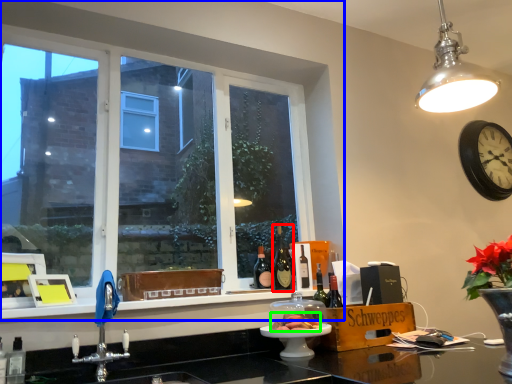
Question: Estimate the real-world distances between objects in this image. Which object is closer to bottle (highlighted by a red box), window (highlighted by a blue box) or food (highlighted by a green box)?

Choices:
 (A) window
 (B) food

Answer: (B)